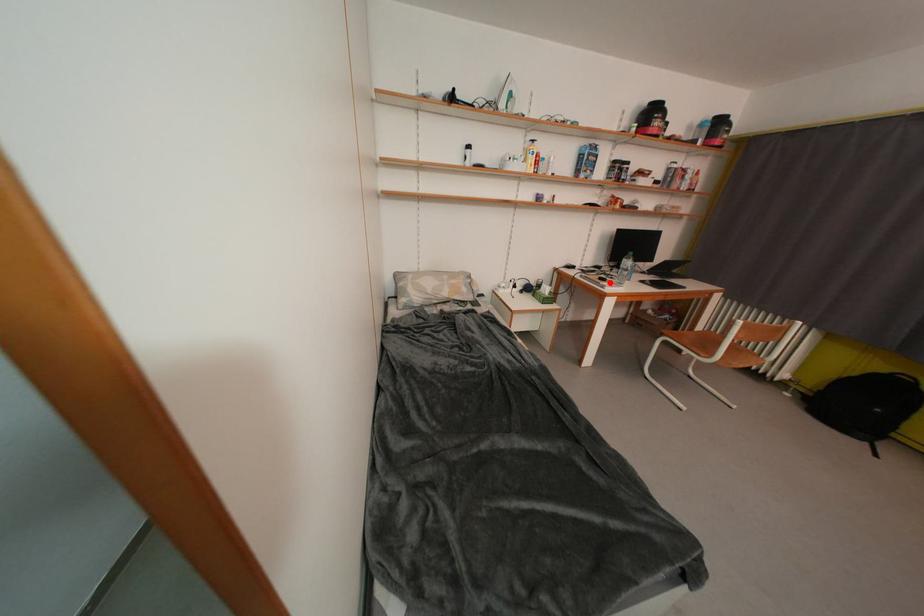
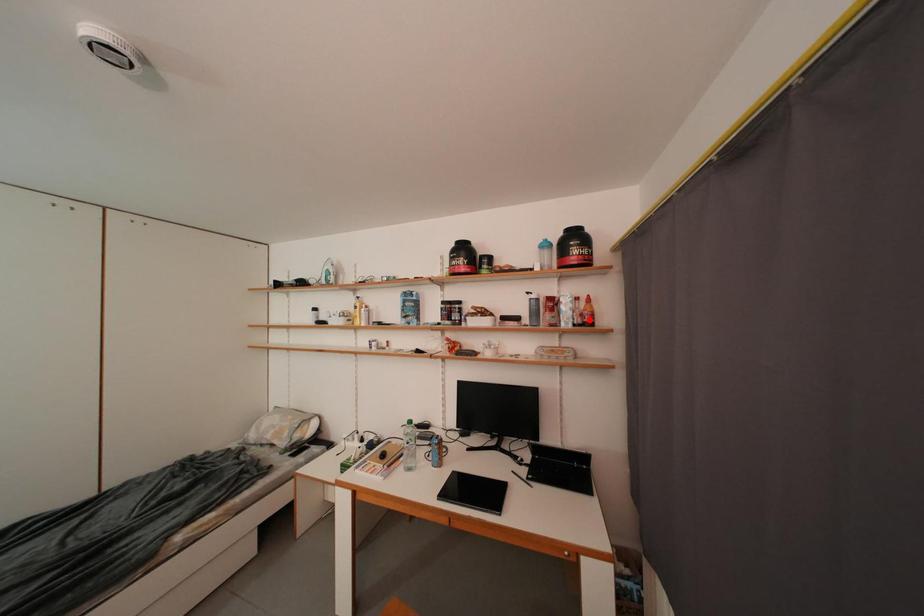
I am providing you with two images of the same scene from different viewpoints. A red point is marked on the first image and another point is marked on the second image. Does the point marked in image1 correspond to the same location as the one in image2?

No